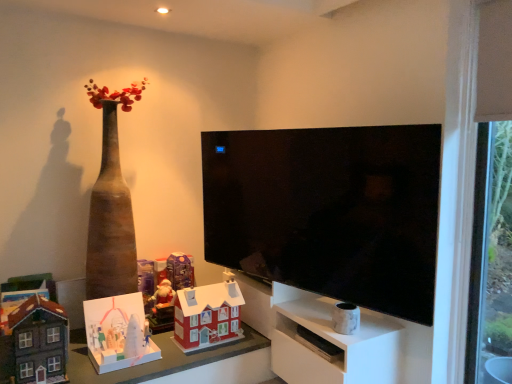
I want to click on space that is in front of white cardboard house at lower left, which is the second toy in left-to-right order, so click(x=109, y=372).